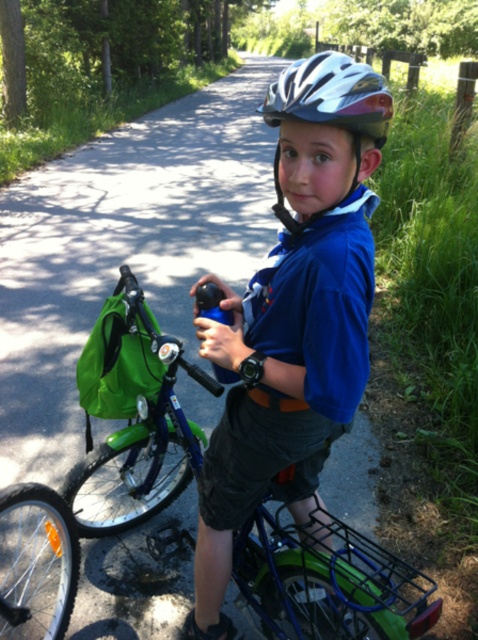
The boy is wearing a blue fabric shirt at center and has a silver metallic helmet at center. Which item has a greater width?

The blue fabric shirt at center has a greater width than the silver metallic helmet at center.

You are a delivery robot with a 60 cm wide package. You need to pass between the blue fabric shirt at center and the silver metallic helmet at center. Can you fit through the space between them?

The distance between the blue fabric shirt at center and the silver metallic helmet at center is 58.10 centimeters. Since the package is 60 cm wide, it is slightly wider than the available space. Therefore, the package cannot fit through the gap between them.